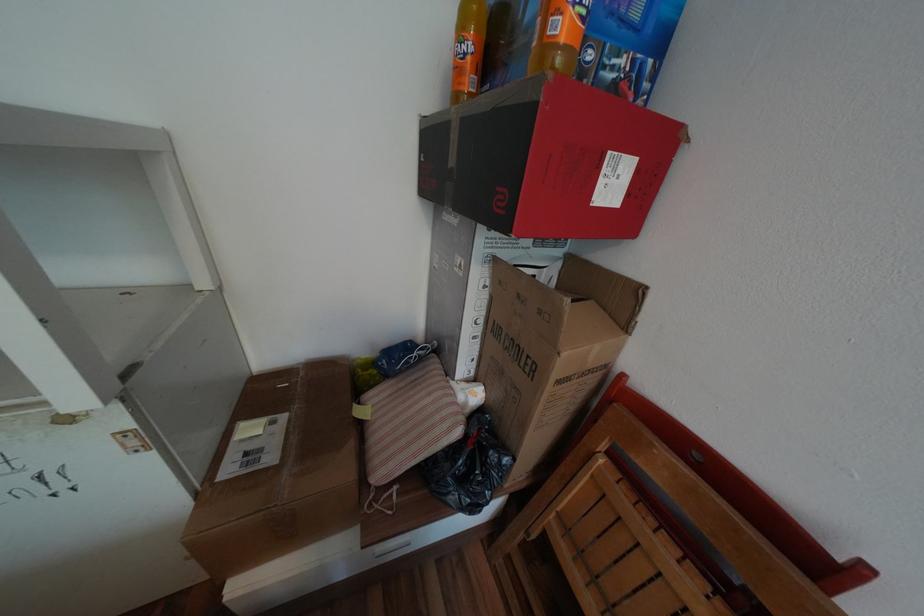
The location [548,160] corresponds to which object?

It corresponds to the red and black box in the image.